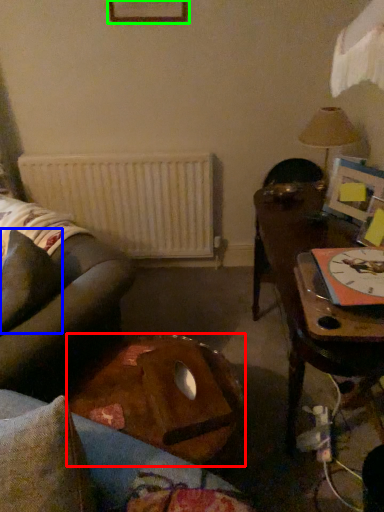
Question: Which is nearer to the table (highlighted by a red box)? pillow (highlighted by a blue box) or picture frame (highlighted by a green box).

Choices:
 (A) pillow
 (B) picture frame

Answer: (A)